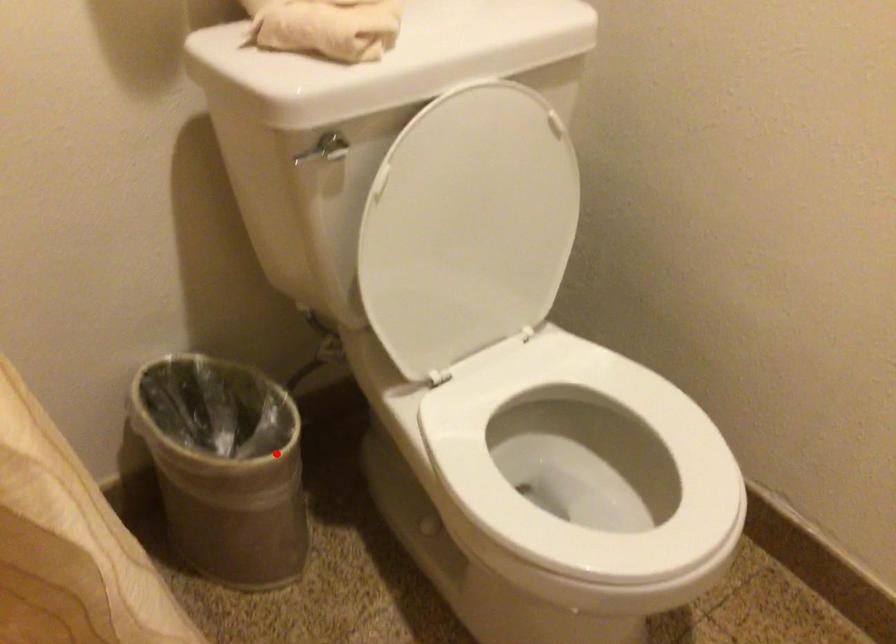
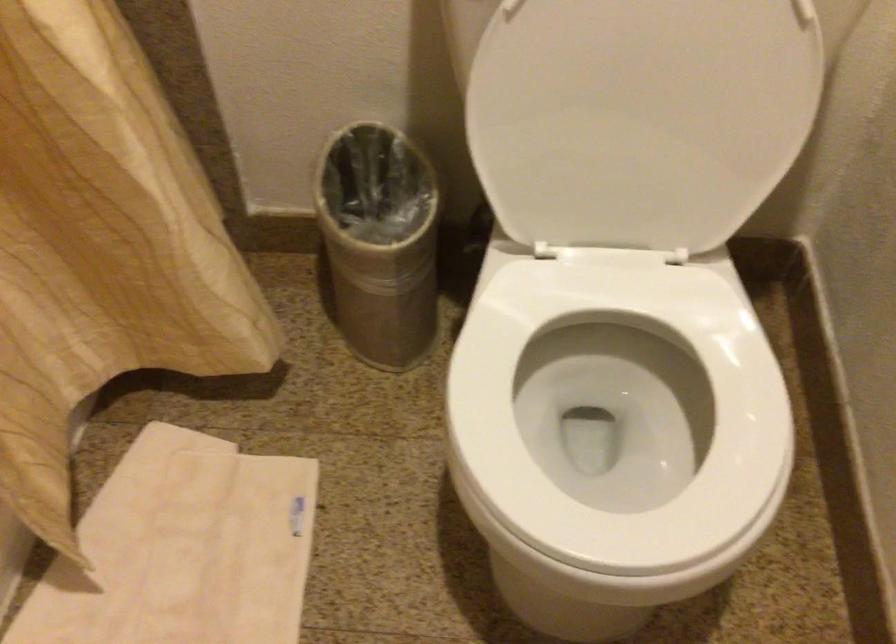
Question: I am providing you with two images of the same scene from different viewpoints. A red point is marked on the first image. At the location where the point appears in image 1, is it still visible in image 2?

Choices:
 (A) Yes
 (B) No

Answer: (A)